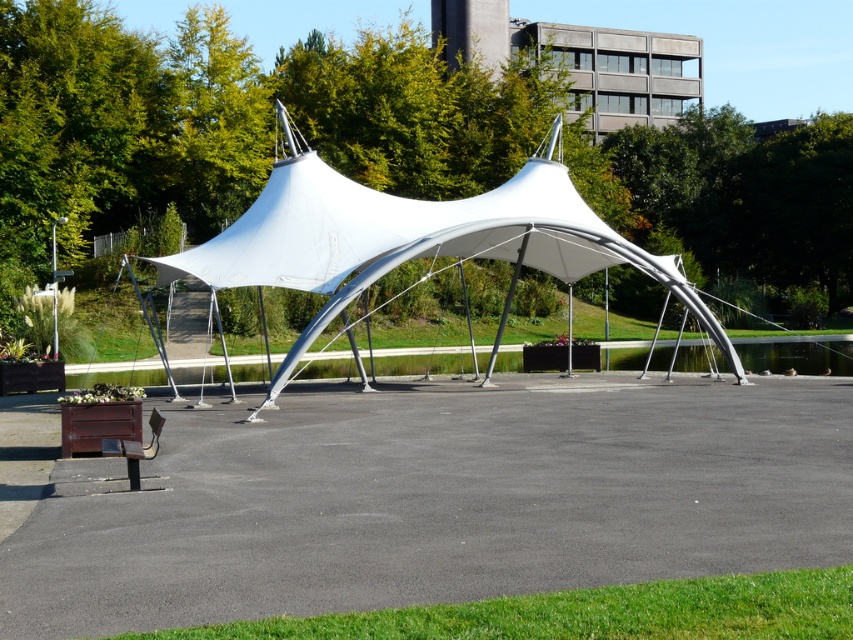
Question: Which point is farther from the camera taking this photo?

Choices:
 (A) (544, 269)
 (B) (135, 474)

Answer: (A)

Question: In this image, where is white fabric tent at center located relative to wooden park bench at lower left?

Choices:
 (A) above
 (B) below

Answer: (A)

Question: Does white fabric tent at center appear on the left side of wooden park bench at lower left?

Choices:
 (A) yes
 (B) no

Answer: (B)

Question: Does white fabric tent at center lie in front of wooden park bench at lower left?

Choices:
 (A) yes
 (B) no

Answer: (B)